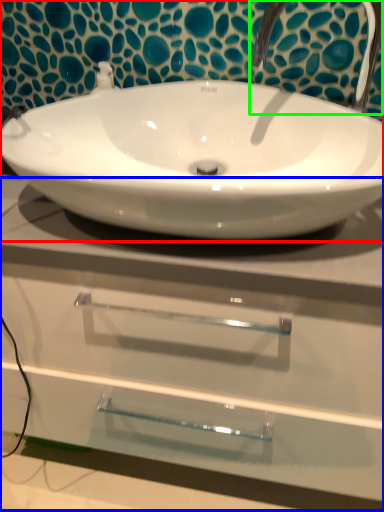
Question: Considering the real-world distances, which object is farthest from sink (highlighted by a red box)? counter top (highlighted by a blue box) or plumbing fixture (highlighted by a green box)?

Choices:
 (A) counter top
 (B) plumbing fixture

Answer: (A)